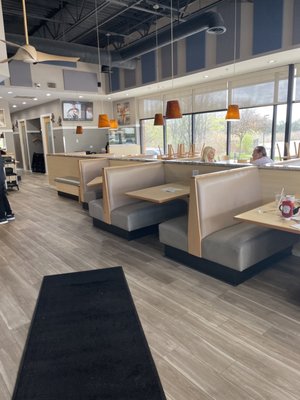
Identify the location of bottle of ketchup. (287, 213).